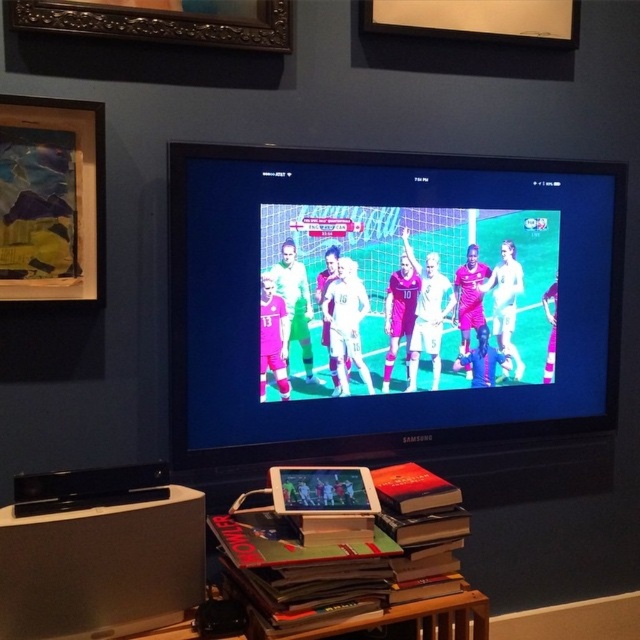
Is pink fabric soccer players at center above wooden-framed artwork at upper left?

Incorrect, pink fabric soccer players at center is not positioned above wooden-framed artwork at upper left.

Does pink fabric soccer players at center have a smaller size compared to wooden-framed artwork at upper left?

Incorrect, pink fabric soccer players at center is not smaller in size than wooden-framed artwork at upper left.

Which is behind, point (547, 324) or point (49, 131)?

The point (547, 324) is more distant.

Image resolution: width=640 pixels, height=640 pixels. What are the coordinates of `pink fabric soccer players at center` in the screenshot? It's located at (410, 292).

Can you confirm if matte plastic television at center is taller than pink fabric soccer players at center?

Indeed, matte plastic television at center has a greater height compared to pink fabric soccer players at center.

The width and height of the screenshot is (640, 640). What do you see at coordinates (388, 292) in the screenshot?
I see `matte plastic television at center` at bounding box center [388, 292].

In order to click on matte plastic television at center in this screenshot , I will do pos(388,292).

Who is more forward, (230, 344) or (449, 26)?

Positioned in front is point (230, 344).

The width and height of the screenshot is (640, 640). Describe the element at coordinates (388, 292) in the screenshot. I see `matte plastic television at center` at that location.

Does point (385, 316) come behind point (529, 4)?

No, (385, 316) is in front of (529, 4).

Identify the location of matte plastic television at center. (388, 292).